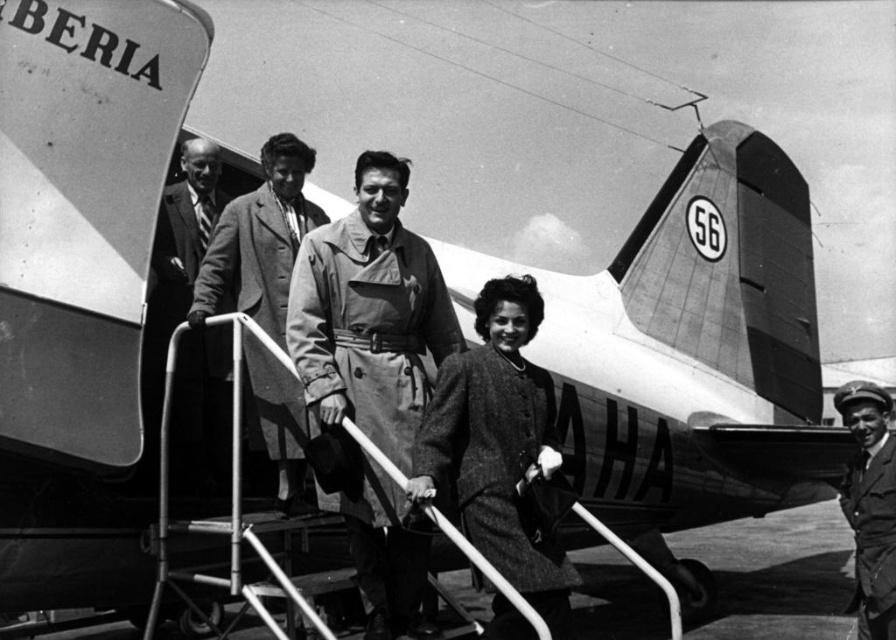
You are standing in front of the aircraft and notice two points marked on the fuselage. The first point is at coordinates point (x=506, y=349) and the second point is at point (x=154, y=348). Which point is closer to you?

Point (x=506, y=349) is further to the viewer than point (x=154, y=348), so the point closer to you is point (x=154, y=348).